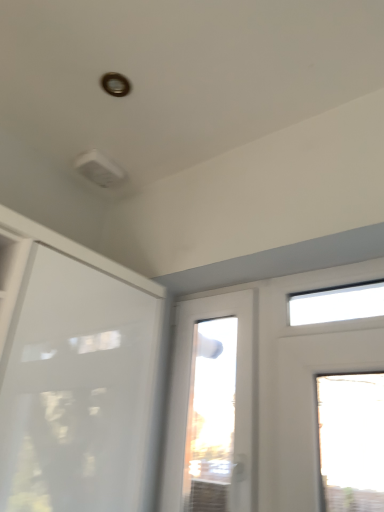
Find the location of a particular element. Image resolution: width=384 pixels, height=512 pixels. white matte door at upper left is located at coordinates (76, 389).

Describe the element at coordinates (76, 389) in the screenshot. I see `white matte door at upper left` at that location.

The width and height of the screenshot is (384, 512). Describe the element at coordinates (213, 406) in the screenshot. I see `white glossy door at center` at that location.

Locate an element on the screen. white glossy door at center is located at coordinates (213, 406).

Locate an element on the screen. white matte door at upper left is located at coordinates 76,389.

Considering the positions of objects white matte door at upper left and white glossy door at center in the image provided, who is more to the right, white matte door at upper left or white glossy door at center?

From the viewer's perspective, white glossy door at center appears more on the right side.

Considering their positions, is white matte door at upper left located in front of or behind white glossy door at center?

Visually, white matte door at upper left is located in front of white glossy door at center.

Considering the positions of point (13, 365) and point (192, 404), is point (13, 365) closer or farther from the camera than point (192, 404)?

Point (13, 365) appears to be closer to the viewer than point (192, 404).

From the image's perspective, is white matte door at upper left on top of white glossy door at center?

Correct, white matte door at upper left appears higher than white glossy door at center in the image.

From a real-world perspective, which object rests below the other?

white matte door at upper left.

Can you confirm if white matte door at upper left is thinner than white glossy door at center?

No.

Is white matte door at upper left taller or shorter than white glossy door at center?

Considering their sizes, white matte door at upper left has less height than white glossy door at center.

Does white matte door at upper left have a smaller size compared to white glossy door at center?

No.

Do you think white matte door at upper left is within white glossy door at center, or outside of it?

white matte door at upper left is spatially situated outside white glossy door at center.

Is white matte door at upper left far away from white glossy door at center?

No, white matte door at upper left is not far from white glossy door at center.

Could you tell me if white matte door at upper left is turned towards white glossy door at center?

No, white matte door at upper left is not oriented towards white glossy door at center.

Measure the distance from white matte door at upper left to white glossy door at center.

The distance of white matte door at upper left from white glossy door at center is 16.01 inches.

Locate an element on the screen. The height and width of the screenshot is (512, 384). window that is on the right side of white matte door at upper left is located at coordinates (213, 406).

In the scene shown: Would you say white glossy door at center is to the left or to the right of white matte door at upper left in the picture?

Clearly, white glossy door at center is on the right of white matte door at upper left in the image.

Relative to white matte door at upper left, is white glossy door at center in front or behind?

Clearly, white glossy door at center is behind white matte door at upper left.

Does point (202, 466) come behind point (11, 480)?

Yes.

From the image's perspective, does white glossy door at center appear lower than white matte door at upper left?

Yes, from the image's perspective, white glossy door at center is below white matte door at upper left.

From a real-world perspective, is white glossy door at center above or below white matte door at upper left?

white glossy door at center is above white matte door at upper left.

Does white glossy door at center have a greater width compared to white matte door at upper left?

No.

Considering the sizes of white glossy door at center and white matte door at upper left in the image, is white glossy door at center taller or shorter than white matte door at upper left?

Considering their sizes, white glossy door at center has more height than white matte door at upper left.

Between white glossy door at center and white matte door at upper left, which one has smaller size?

With smaller size is white glossy door at center.

Is white glossy door at center outside of white matte door at upper left?

That's correct, white glossy door at center is outside of white matte door at upper left.

Are white glossy door at center and white matte door at upper left beside each other?

They are not placed beside each other.

Does white glossy door at center turn towards white matte door at upper left?

Yes, white glossy door at center faces towards white matte door at upper left.

How different are the orientations of white glossy door at center and white matte door at upper left in degrees?

The angular difference between white glossy door at center and white matte door at upper left is 91.4 degrees.

Measure the distance from white glossy door at center to white matte door at upper left.

They are 16.01 inches apart.

At what (x,y) coordinates should I click in order to perform the action: click on window to the right of white matte door at upper left. Please return your answer as a coordinate pair (x, y). The width and height of the screenshot is (384, 512). Looking at the image, I should click on (213, 406).

This screenshot has height=512, width=384. In the image, there is a white glossy door at center. Identify the location of door below it (from a real-world perspective). (76, 389).

The image size is (384, 512). Identify the location of window located behind the white matte door at upper left. (213, 406).